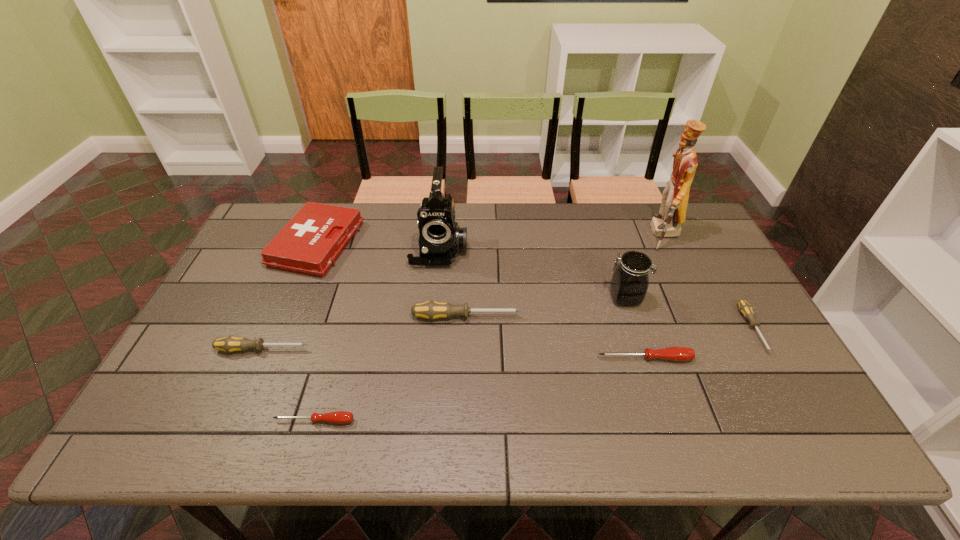
In the image, there is a desktop. At what (x,y) coordinates should I click in order to perform the action: click on vacant space at the near left corner. Please return your answer as a coordinate pair (x, y). This screenshot has height=540, width=960. Looking at the image, I should click on (183, 443).

Where is `vacant space at the near right corner of the desktop`? This screenshot has height=540, width=960. vacant space at the near right corner of the desktop is located at coordinates (783, 426).

Locate an element on the screen. free point between the shortest object and the right red screwdriver is located at coordinates (480, 389).

You are a GUI agent. You are given a task and a screenshot of the screen. Output one action in this format:
    pyautogui.click(x=<x>, y=<y>)
    Task: Click on the vacant point located between the leftmost gray screwdriver and the rightmost gray screwdriver
    
    Given the screenshot: What is the action you would take?
    pyautogui.click(x=508, y=339)

Where is `free space between the jar and the biggest gray screwdriver`? The width and height of the screenshot is (960, 540). free space between the jar and the biggest gray screwdriver is located at coordinates (545, 307).

At what (x,y) coordinates should I click in order to perform the action: click on vacant region between the red first-aid kit and the left red screwdriver. Please return your answer as a coordinate pair (x, y). This screenshot has height=540, width=960. Looking at the image, I should click on (316, 332).

This screenshot has width=960, height=540. In order to click on unoccupied area between the third screwdriver from right to left and the smallest gray screwdriver in this screenshot , I will do `click(610, 323)`.

Image resolution: width=960 pixels, height=540 pixels. Identify the location of vacant space in between the third screwdriver from left to right and the nearest screwdriver. (391, 369).

Find the location of a particular element. This screenshot has height=540, width=960. unoccupied area between the second gray screwdriver from right to left and the smallest gray screwdriver is located at coordinates (610, 323).

Image resolution: width=960 pixels, height=540 pixels. Identify the location of vacant space that's between the red nutcracker and the rightmost gray screwdriver. (708, 282).